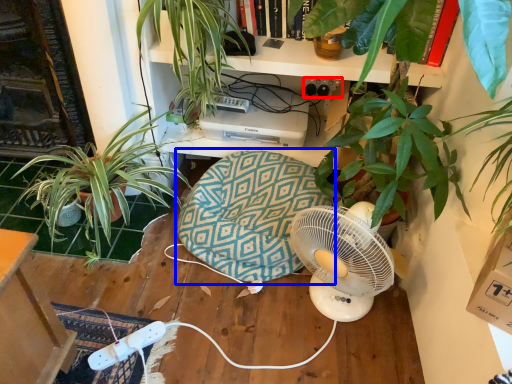
Question: Which object is closer to the camera taking this photo, plug (highlighted by a red box) or swivel chair (highlighted by a blue box)?

Choices:
 (A) plug
 (B) swivel chair

Answer: (B)